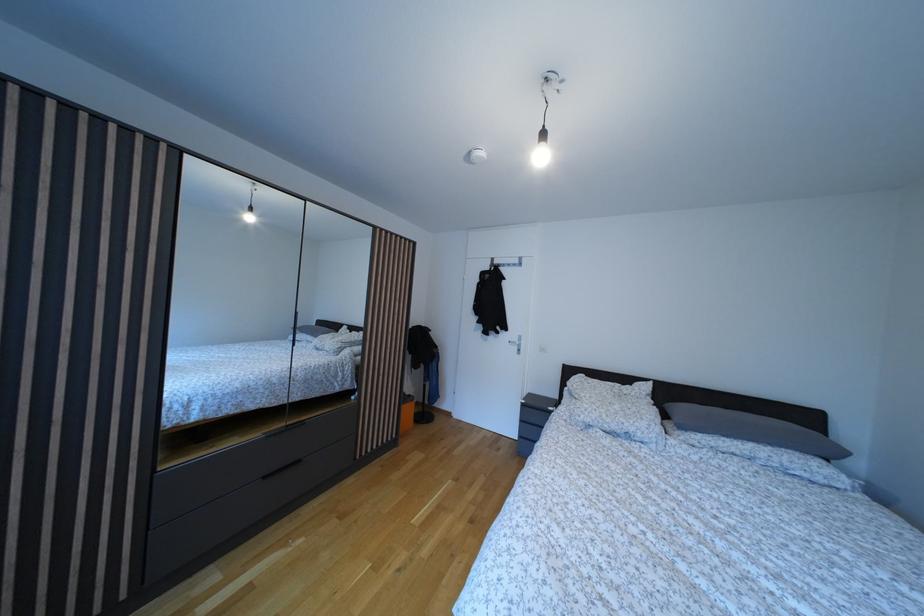
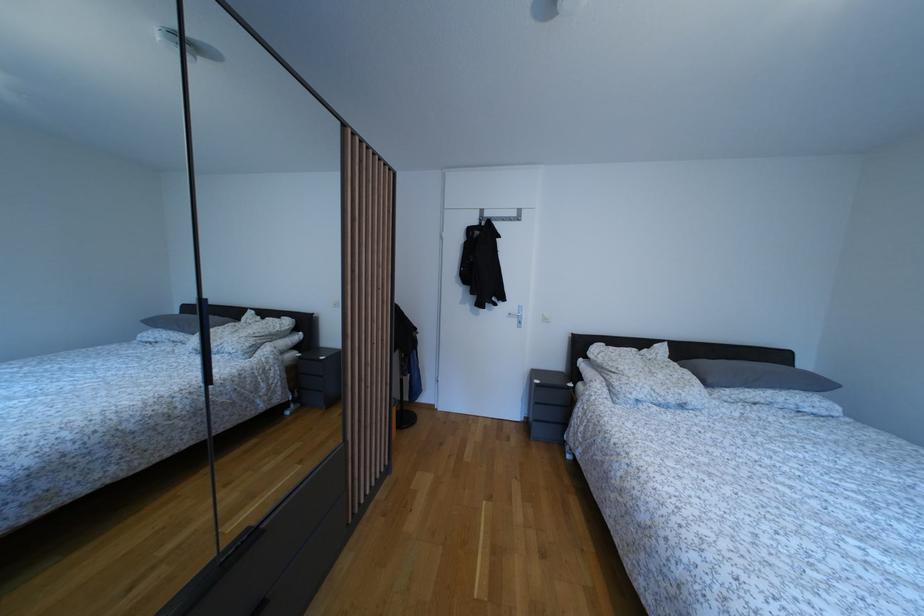
Question: Based on the continuous images, in which direction is the camera rotating? Reply with the corresponding letter.

Choices:
 (A) Left
 (B) Right
 (C) Up
 (D) Down

Answer: (B)